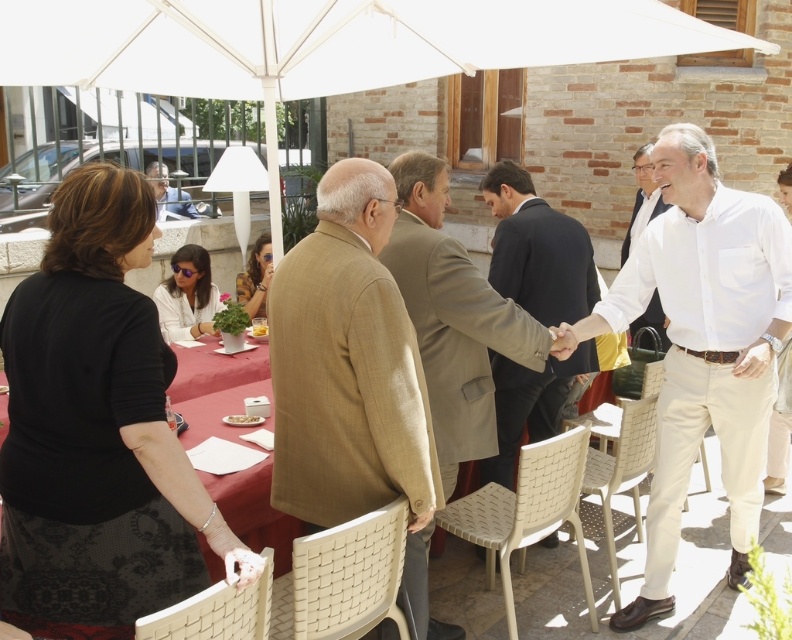
Looking at this image, you are a photographer at the event and want to capture a photo that includes both the white fabric umbrella at upper center and the matte black dress at center. Given that your camera has a maximum focus range of 2.5 meters, will you be able to include both in the same shot without moving closer?

The white fabric umbrella at upper center and the matte black dress at center are 2.77 meters apart from each other. Since the distance between them exceeds the camera maximum focus range of 2.5 meters, you will not be able to include both in the same shot without moving closer.